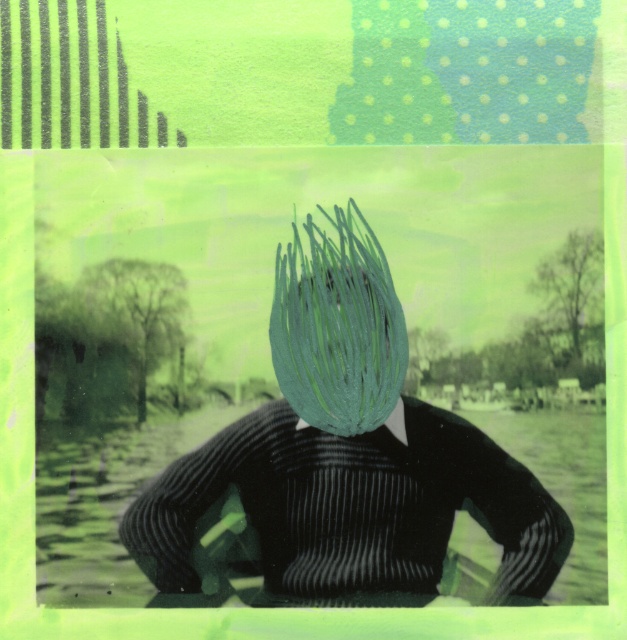
You are a stylist observing a person with a green, spiky plant structure covering their face. You notice a matte green hairbrush at center and green matte hair at center. Which object is located to the right of the other?

The matte green hairbrush at center is positioned on the right side of green matte hair at center.

You are a stylist observing the digitally manipulated image of a person with a green, spiky plant structure on their head. You notice a matte green hairbrush at center and green matte hair at center. Which object is positioned lower on the person?

The matte green hairbrush at center is located below the green matte hair at center, so it is positioned lower on the person.

You are standing at the origin point in the image and see two points labeled as point (293,452) and point (292,323). Which point is closer to you?

Point (293,452) is in front of point (292,323), so it is closer to you.